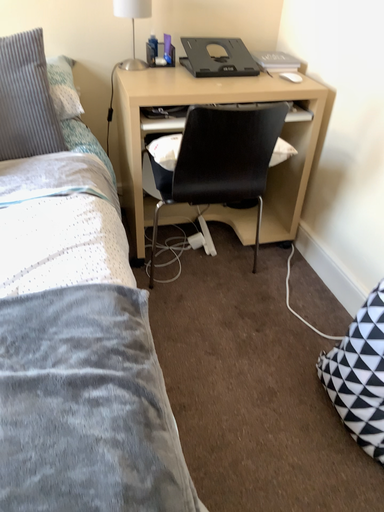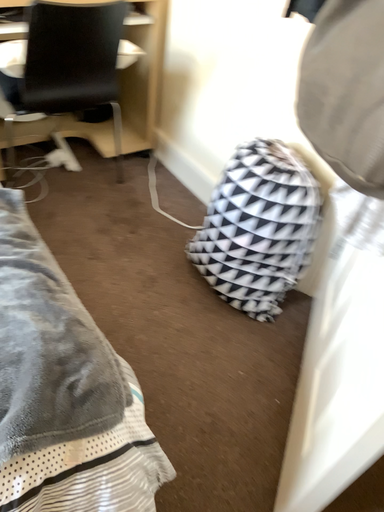
Question: Which way did the camera rotate in the video?

Choices:
 (A) rotated downward
 (B) rotated upward

Answer: (A)